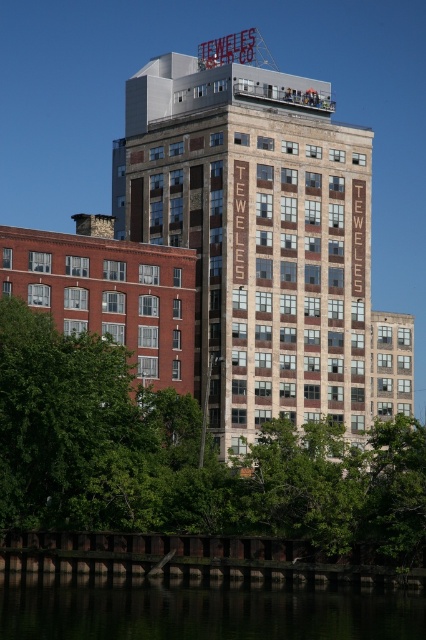
Can you confirm if green leafy tree at lower left is positioned below green reflective water at lower center?

No, green leafy tree at lower left is not below green reflective water at lower center.

Does green leafy tree at lower left have a lesser height compared to green reflective water at lower center?

No, green leafy tree at lower left is not shorter than green reflective water at lower center.

Locate an element on the screen. The width and height of the screenshot is (426, 640). green leafy tree at lower left is located at coordinates (187, 458).

Who is higher up, brown brick building at center or green leafy tree at lower left?

brown brick building at center is above.

Which is behind, point (265, 388) or point (63, 436)?

Point (265, 388)

The width and height of the screenshot is (426, 640). I want to click on brown brick building at center, so click(256, 234).

Is brown brick building at center positioned at the back of green reflective water at lower center?

Yes, brown brick building at center is further from the viewer.

What do you see at coordinates (256, 234) in the screenshot?
I see `brown brick building at center` at bounding box center [256, 234].

Where is `brown brick building at center`? brown brick building at center is located at coordinates (x=256, y=234).